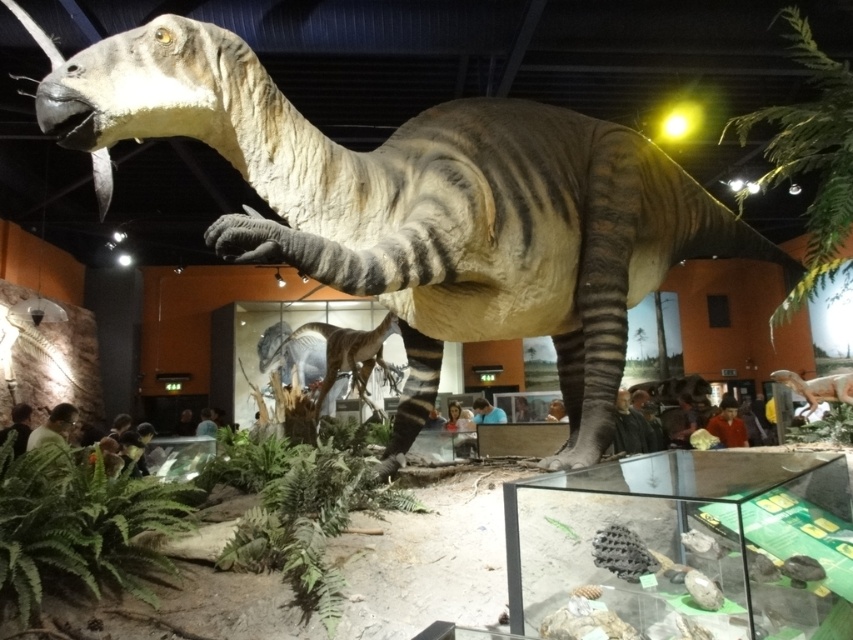
You are a museum visitor who wants to take a photo of both the matte gray dinosaur at center and the smooth brown dinosaur at center. Since you have a camera with a limited zoom, which dinosaur should you stand closer to in order to capture both in the same frame?

The matte gray dinosaur at center is larger than the smooth brown dinosaur at center. To include both in the same frame without zooming, you should stand closer to the matte gray dinosaur at center so that it doesn not dominate the frame excessively while still keeping the smaller smooth brown dinosaur at center visible.

You are a museum visitor standing in front of the dinosaur exhibit. You see the matte gray dinosaur at center and the smooth brown dinosaur at center. Which one is positioned to the right side?

The matte gray dinosaur at center is positioned to the right of the smooth brown dinosaur at center.

In the scene shown: You are a museum visitor who wants to take a photo of both the matte gray dinosaur at center and the smooth brown dinosaur at center. Since you have a wide angle lens, you want to know which dinosaur is wider so you can position yourself accordingly. Can you tell me which one is wider?

The matte gray dinosaur at center is wider than the smooth brown dinosaur at center according to the description.